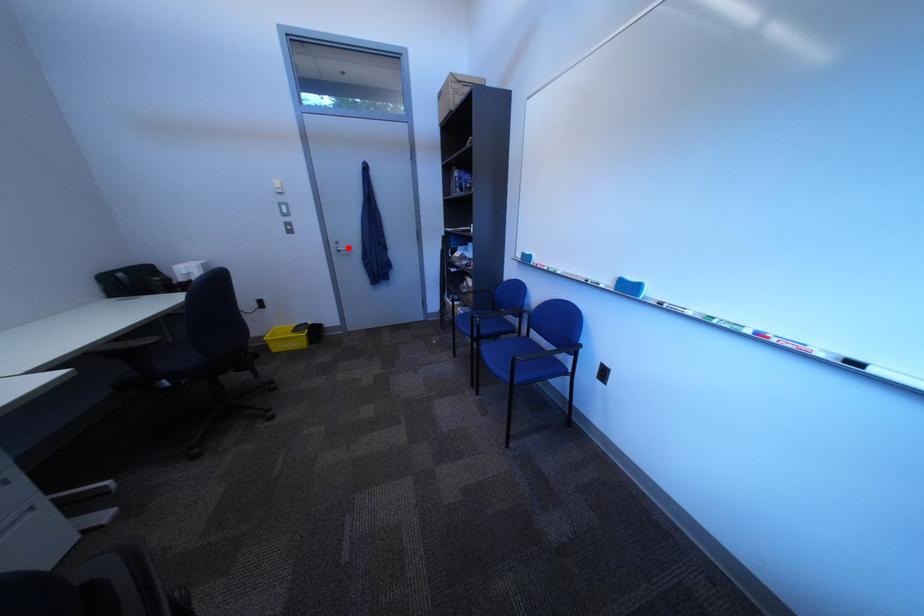
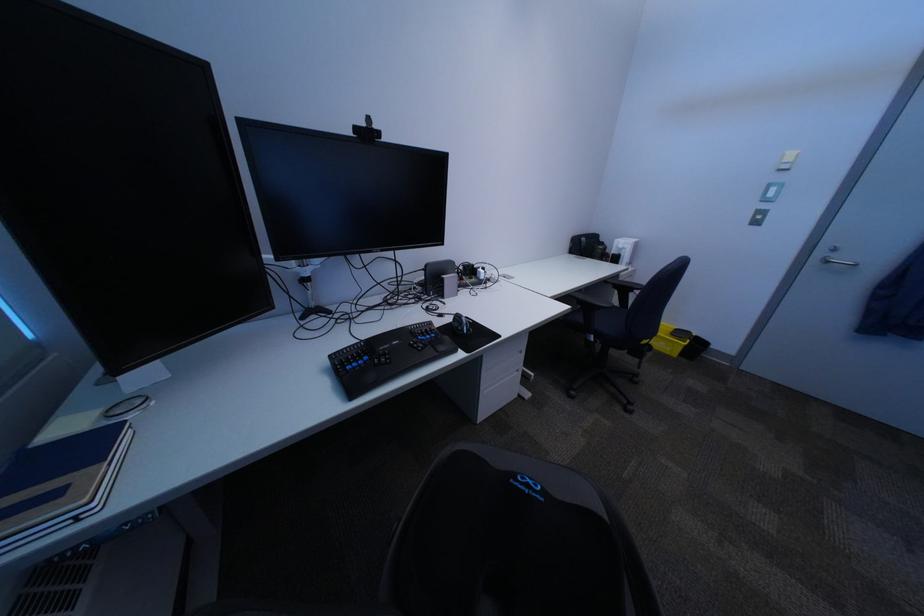
Locate, in the second image, the point that corresponds to the highlighted location in the first image.

(834, 254)